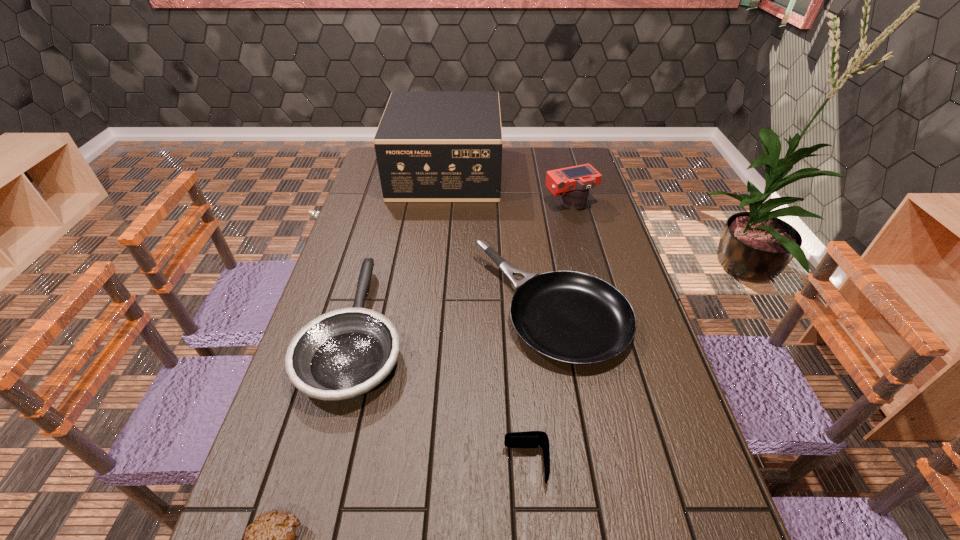
Locate an element on the screen. The image size is (960, 540). free space at the far edge of the desktop is located at coordinates (544, 166).

The width and height of the screenshot is (960, 540). Find the location of `free space at the left edge of the desktop`. free space at the left edge of the desktop is located at coordinates (344, 238).

I want to click on vacant space at the right edge of the desktop, so [x=636, y=478].

Find the location of a particular element. vacant space that is in between the frying pan and the second nearest object is located at coordinates (442, 398).

Where is `free spot between the pan and the frying pan`? This screenshot has height=540, width=960. free spot between the pan and the frying pan is located at coordinates (454, 320).

At what (x,y) coordinates should I click in order to perform the action: click on free space between the frying pan and the tallest object. Please return your answer as a coordinate pair (x, y). Looking at the image, I should click on (401, 252).

This screenshot has width=960, height=540. I want to click on free space between the wallet and the frying pan, so click(442, 398).

The image size is (960, 540). Identify the location of object identified as the closest to the frying pan. (571, 317).

Select which object is the second closest to the fifth shortest object. Please provide its 2D coordinates. Your answer should be formatted as a tuple, i.e. [(x, y)], where the tuple contains the x and y coordinates of a point satisfying the conditions above.

[(571, 317)]

I want to click on blank area in the image that satisfies the following two spatial constraints: 1. on the front-facing side of the camera; 2. on the left side of the box, so 442,204.